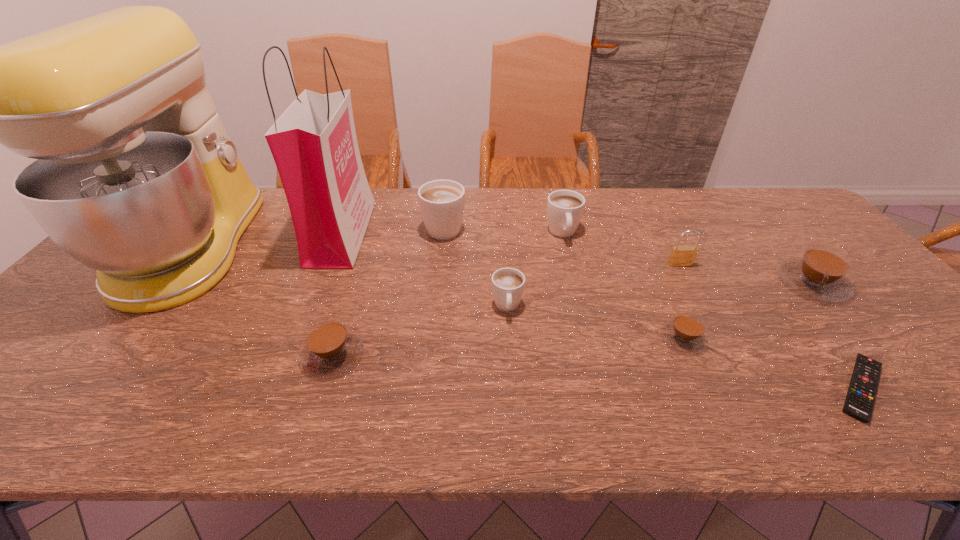
Where is `white cappuccino that is the closest to the smallest brown cappuccino`? This screenshot has height=540, width=960. white cappuccino that is the closest to the smallest brown cappuccino is located at coordinates (508, 284).

At what (x,y) coordinates should I click in order to perform the action: click on white cappuccino identified as the third closest to the rightmost brown cappuccino. Please return your answer as a coordinate pair (x, y). This screenshot has height=540, width=960. Looking at the image, I should click on (441, 202).

Identify which brown cappuccino is located as the third nearest to the second biggest white cappuccino. Please provide its 2D coordinates. Your answer should be formatted as a tuple, i.e. [(x, y)], where the tuple contains the x and y coordinates of a point satisfying the conditions above.

[(330, 348)]

Image resolution: width=960 pixels, height=540 pixels. What are the coordinates of `brown cappuccino that is the second nearest to the ninth tallest object` in the screenshot? It's located at (330, 348).

You are a GUI agent. You are given a task and a screenshot of the screen. Output one action in this format:
    pyautogui.click(x=<x>, y=<y>)
    Task: Click on the vacant point that satisfies the following two spatial constraints: 1. on the side of the second brown cappuccino from left to right with the control knob; 2. on the right side of the mixer
    
    Given the screenshot: What is the action you would take?
    pyautogui.click(x=119, y=338)

The image size is (960, 540). I want to click on vacant space that satisfies the following two spatial constraints: 1. on the front-facing side of the remote control; 2. on the left side of the pink shopping bag, so click(x=278, y=388).

In order to click on vacant area that satisfies the following two spatial constraints: 1. on the back side of the second brown cappuccino from left to right; 2. on the front-facing side of the shopping bag in this screenshot , I will do `click(636, 233)`.

Find the location of `free spot that satisfies the following two spatial constraints: 1. with the handle on the side of the smallest white cappuccino; 2. on the left side of the shortest object`. free spot that satisfies the following two spatial constraints: 1. with the handle on the side of the smallest white cappuccino; 2. on the left side of the shortest object is located at coordinates (513, 388).